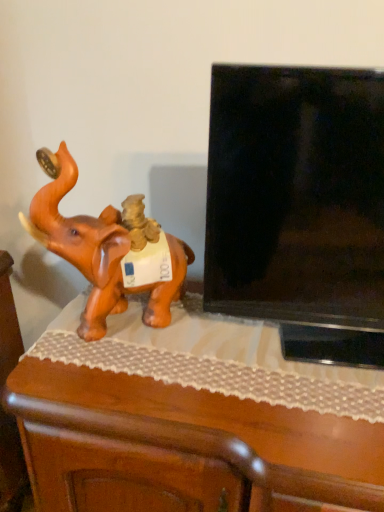
You are a GUI agent. You are given a task and a screenshot of the screen. Output one action in this format:
    pyautogui.click(x=<x>, y=<y>)
    Task: Click on the wooden table at left
    
    Given the screenshot: What is the action you would take?
    pos(192,418)

From a real-world perspective, is orange matte elephant at left located higher than wooden table at left?

Yes, from a real-world perspective, orange matte elephant at left is over wooden table at left

Considering the relative sizes of orange matte elephant at left and wooden table at left in the image provided, is orange matte elephant at left taller than wooden table at left?

Incorrect, the height of orange matte elephant at left is not larger of that of wooden table at left.

You are a GUI agent. You are given a task and a screenshot of the screen. Output one action in this format:
    pyautogui.click(x=<x>, y=<y>)
    Task: Click on the furniture on the right side of orange matte elephant at left
    
    Given the screenshot: What is the action you would take?
    pyautogui.click(x=192, y=418)

Is orange matte elephant at left wider than wooden table at left?

In fact, orange matte elephant at left might be narrower than wooden table at left.

The width and height of the screenshot is (384, 512). What are the coordinates of `television located on the right of wooden table at left` in the screenshot? It's located at (299, 207).

Could you tell me if wooden table at left is facing black glossy tv at right?

No.

Based on the photo, is wooden table at left inside the boundaries of black glossy tv at right, or outside?

wooden table at left is not enclosed by black glossy tv at right.

From a real-world perspective, is wooden table at left below black glossy tv at right?

Yes.

In terms of size, does orange matte elephant at left appear bigger or smaller than black glossy tv at right?

orange matte elephant at left is smaller than black glossy tv at right.

From the image's perspective, is orange matte elephant at left over black glossy tv at right?

No, from the image's perspective, orange matte elephant at left is not on top of black glossy tv at right.

Is orange matte elephant at left not near black glossy tv at right?

No, orange matte elephant at left is in close proximity to black glossy tv at right.

From a real-world perspective, is orange matte elephant at left under black glossy tv at right?

Correct, in the physical world, orange matte elephant at left is lower than black glossy tv at right.

Which is behind, wooden table at left or orange matte elephant at left?

orange matte elephant at left is further away from the camera.

Are wooden table at left and orange matte elephant at left beside each other?

No.

Could you tell me if wooden table at left is turned towards orange matte elephant at left?

No, wooden table at left is not oriented towards orange matte elephant at left.

Can you tell me how much wooden table at left and orange matte elephant at left differ in facing direction?

The angle between the facing direction of wooden table at left and the facing direction of orange matte elephant at left is 23.8 degrees.

The height and width of the screenshot is (512, 384). Identify the location of television on the right of orange matte elephant at left. (299, 207).

Considering the relative sizes of black glossy tv at right and orange matte elephant at left in the image provided, is black glossy tv at right thinner than orange matte elephant at left?

No.

Between black glossy tv at right and orange matte elephant at left, which one has less height?

orange matte elephant at left is shorter.

Which is behind, point (290, 209) or point (68, 230)?

The point (68, 230) is more distant.

Considering the sizes of objects black glossy tv at right and wooden table at left in the image provided, who is shorter, black glossy tv at right or wooden table at left?

With less height is wooden table at left.

Visually, is black glossy tv at right positioned to the left or to the right of wooden table at left?

Based on their positions, black glossy tv at right is located to the right of wooden table at left.

From a real-world perspective, which is physically below, black glossy tv at right or wooden table at left?

wooden table at left.

Do you think black glossy tv at right is within wooden table at left, or outside of it?

black glossy tv at right is not inside wooden table at left, it's outside.

Find the location of a particular element. Image resolution: width=384 pixels, height=512 pixels. elephant behind the wooden table at left is located at coordinates (105, 251).

Where is `television on the right of wooden table at left`? The width and height of the screenshot is (384, 512). television on the right of wooden table at left is located at coordinates (299, 207).

Looking at the image, which one is located further to wooden table at left, black glossy tv at right or orange matte elephant at left?

black glossy tv at right is further to wooden table at left.

Looking at the image, which one is located further to orange matte elephant at left, wooden table at left or black glossy tv at right?

black glossy tv at right lies further to orange matte elephant at left than the other object.

Based on the photo, considering their positions, is orange matte elephant at left positioned closer to black glossy tv at right than wooden table at left?

Based on the image, wooden table at left appears to be nearer to black glossy tv at right.

When comparing their distances from orange matte elephant at left, does black glossy tv at right or wooden table at left seem further?

The object further to orange matte elephant at left is black glossy tv at right.

Based on their spatial positions, is orange matte elephant at left or black glossy tv at right closer to wooden table at left?

Based on the image, orange matte elephant at left appears to be nearer to wooden table at left.

Based on their spatial positions, is wooden table at left or orange matte elephant at left closer to black glossy tv at right?

The object closer to black glossy tv at right is wooden table at left.

Find the location of a particular element. Image resolution: width=384 pixels, height=512 pixels. elephant between black glossy tv at right and wooden table at left in the up-down direction is located at coordinates (105, 251).